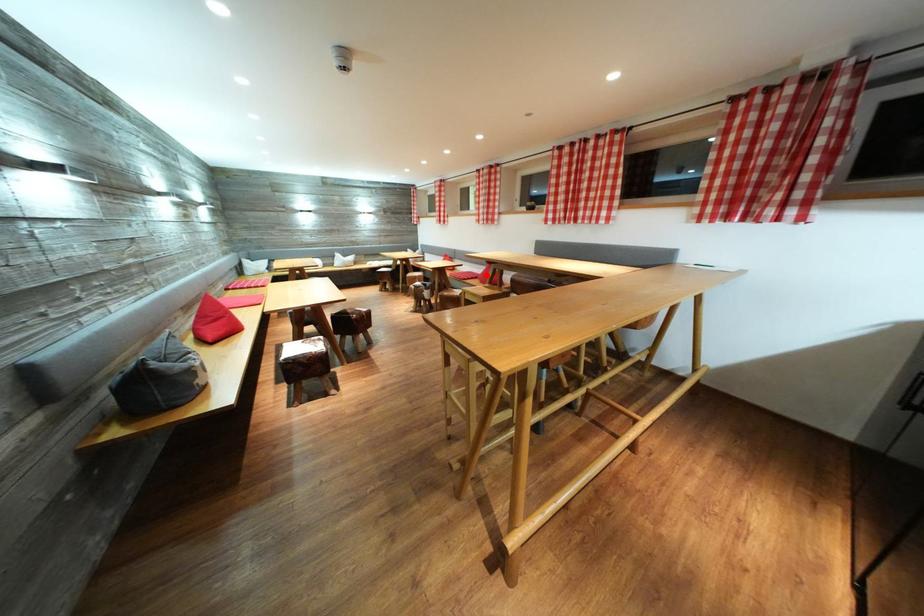
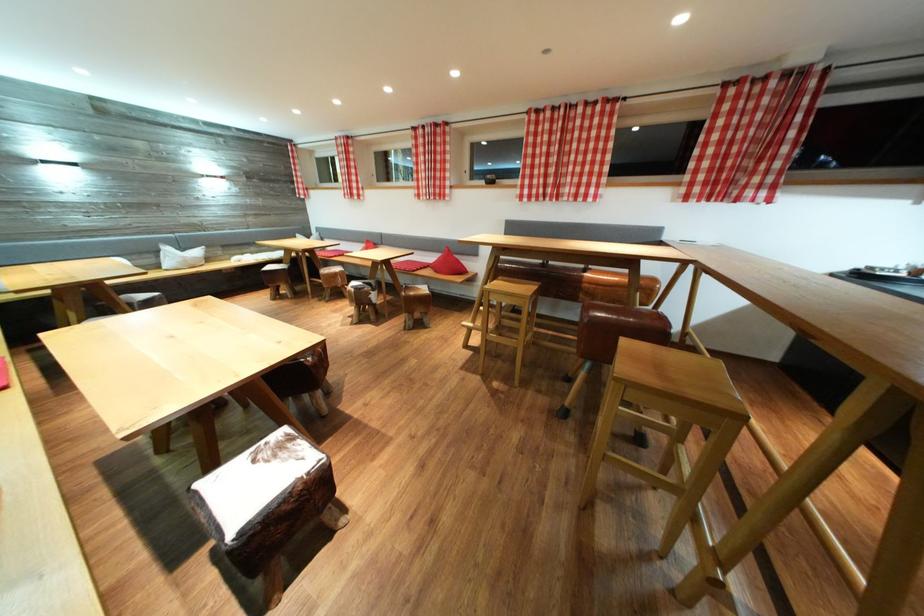
Question: I am providing you with two images of the same scene from different viewpoints. In image1, a red point is highlighted. Considering the same 3D point in image2, which of the following is correct?

Choices:
 (A) It is closer
 (B) It is farther

Answer: (A)